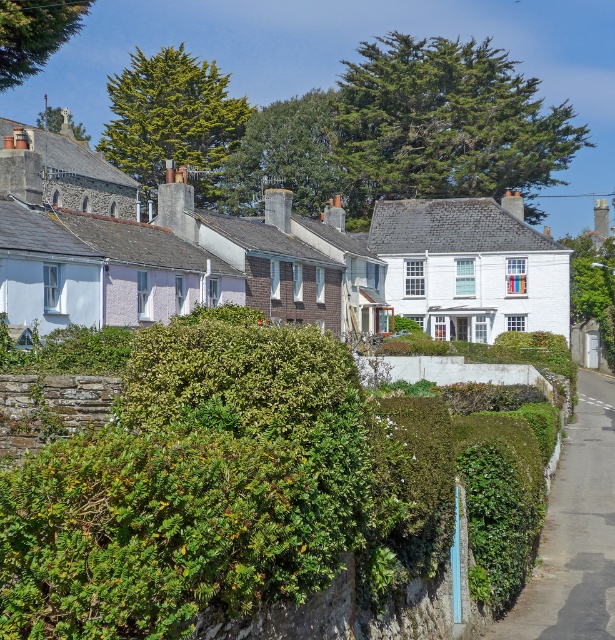
Question: Is green leafy hedge at center smaller than green leafy hedge at lower right?

Choices:
 (A) no
 (B) yes

Answer: (A)

Question: Where is green leafy hedge at center located in relation to green leafy hedge at lower right in the image?

Choices:
 (A) left
 (B) right

Answer: (A)

Question: Which point appears farthest from the camera in this image?

Choices:
 (A) (200, 573)
 (B) (592, 547)

Answer: (B)

Question: Which of the following is the farthest from the observer?

Choices:
 (A) (220, 390)
 (B) (533, 636)

Answer: (B)

Question: Can you confirm if green leafy hedge at center is positioned to the left of green leafy hedge at lower right?

Choices:
 (A) no
 (B) yes

Answer: (B)